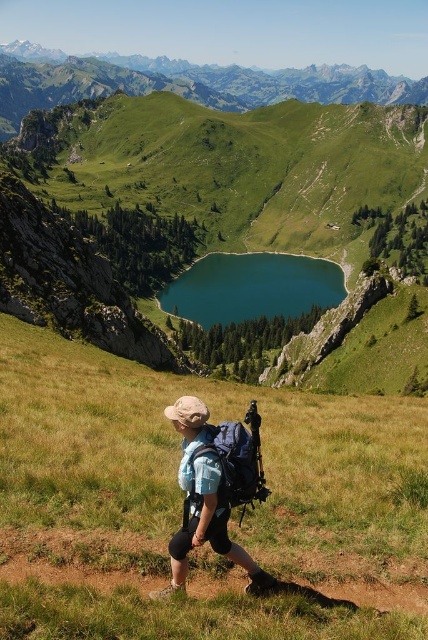
Between green grassy at center and matte blue backpack at center, which one is positioned lower?

matte blue backpack at center is lower down.

Where is `green grassy at center`? The height and width of the screenshot is (640, 428). green grassy at center is located at coordinates (181, 506).

Does teal glossy water at center have a lesser height compared to matte blue backpack at center?

No.

I want to click on teal glossy water at center, so click(x=252, y=288).

Measure the distance between point (109, 412) and camera.

38.10 meters

Between green grassy at center and teal glossy water at center, which one has more height?

Standing taller between the two is teal glossy water at center.

Between point (77, 484) and point (235, 291), which one is positioned in front?

Point (77, 484) is in front.

What are the coordinates of `green grassy at center` in the screenshot? It's located at (181, 506).